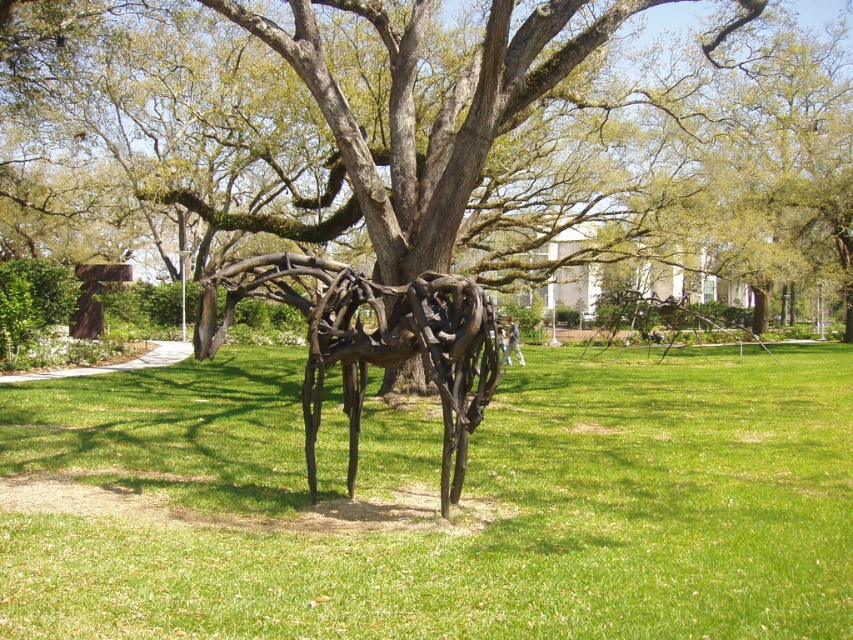
Is green grass at center taller than rustic metal spider at center?

In fact, green grass at center may be shorter than rustic metal spider at center.

Is point (718, 616) positioned before point (323, 280)?

Yes, point (718, 616) is in front of point (323, 280).

You are a GUI agent. You are given a task and a screenshot of the screen. Output one action in this format:
    pyautogui.click(x=<x>, y=<y>)
    Task: Click on the green grass at center
    This screenshot has width=853, height=640.
    Given the screenshot: What is the action you would take?
    pyautogui.click(x=434, y=502)